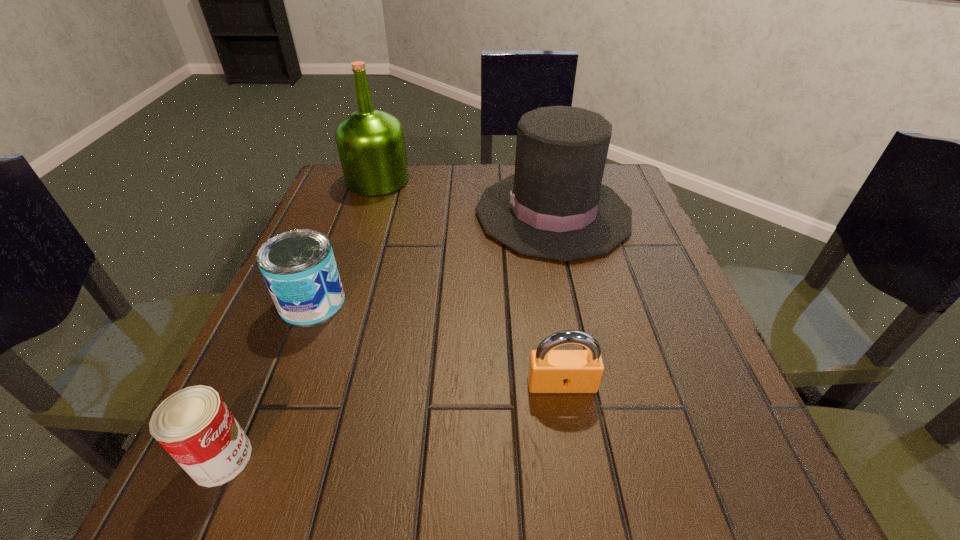
Where is `vacant area that lies between the nearest object and the third farthest object`? vacant area that lies between the nearest object and the third farthest object is located at coordinates pos(267,381).

The image size is (960, 540). I want to click on free point between the third nearest object and the olive oil, so click(x=345, y=241).

Identify the location of free point between the fourth shortest object and the nearest object. This screenshot has height=540, width=960. (388, 336).

Locate an element on the screen. free point between the second nearest object and the third farthest object is located at coordinates (437, 343).

You are a GUI agent. You are given a task and a screenshot of the screen. Output one action in this format:
    pyautogui.click(x=<x>, y=<y>)
    Task: Click on the free spot between the nearer can and the fourth farthest object
    This screenshot has width=960, height=540.
    Given the screenshot: What is the action you would take?
    pyautogui.click(x=392, y=421)

Identify the location of vacant point located between the third nearest object and the padlock. (437, 343).

Find the location of a particular element. This screenshot has height=540, width=960. object that stands as the closest to the farther can is located at coordinates (194, 425).

Locate which object is the third closest to the nearest object. Please provide its 2D coordinates. Your answer should be formatted as a tuple, i.e. [(x, y)], where the tuple contains the x and y coordinates of a point satisfying the conditions above.

[(554, 206)]

Identify the location of free region that satisfies the following two spatial constraints: 1. on the front of the fourth shortest object with the decoration; 2. to unlock the padlock from the front. (590, 384).

At what (x,y) coordinates should I click in order to perform the action: click on vacant space that satisfies the following two spatial constraints: 1. on the front of the dress hat with the decoration; 2. on the front side of the farther can. Please return your answer as a coordinate pair (x, y). This screenshot has height=540, width=960. Looking at the image, I should click on (572, 302).